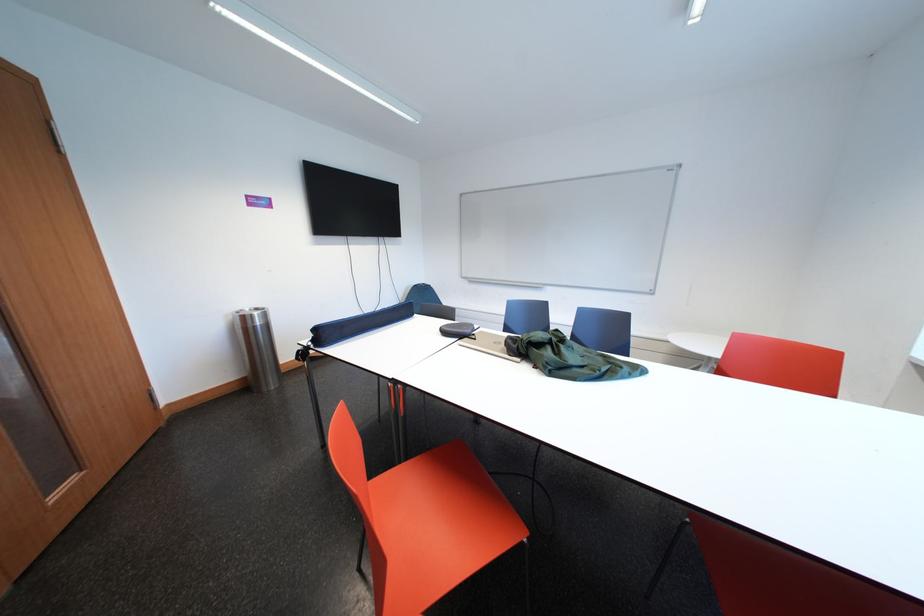
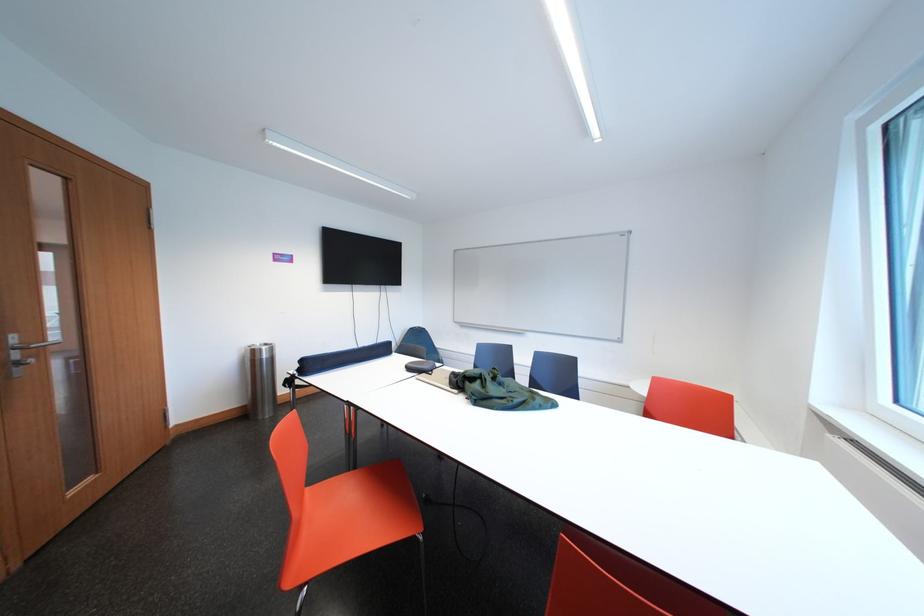
The point at [325,334] is marked in the first image. Where is the corresponding point in the second image?

(311, 365)